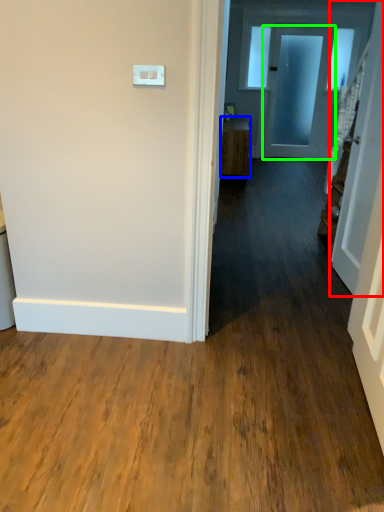
Question: Which is farther away from door (highlighted by a red box)? furniture (highlighted by a blue box) or door (highlighted by a green box)?

Choices:
 (A) furniture
 (B) door

Answer: (B)